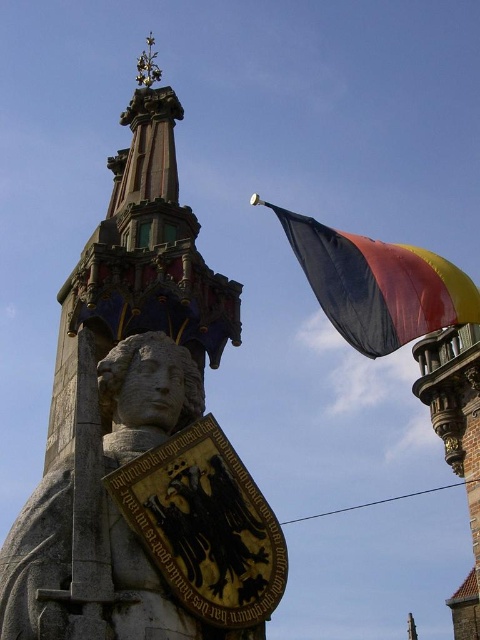
You are an architect analyzing the historic stone structure. You notice a point marked at coordinates (145, 518). Based on the scene description, what significant feature does this point likely indicate?

The point at coordinates (145, 518) marks the location of the stone statue at center.

You are standing in front of the historic stone structure and want to take a photo of both the stone statue at center and the polyester flag at upper right. Which object should you adjust your camera angle to include first if you start from the left side?

The stone statue at center is to the left of the polyester flag at upper right, so you should adjust your camera angle to include the stone statue at center first before moving to the right to capture the polyester flag at upper right.

You are a tourist standing in front of the historic stone structure. You notice the stone statue at center and the polyester flag at upper right. Which object is closer to you?

The stone statue at center is closer to you because it is in front of the polyester flag at upper right.